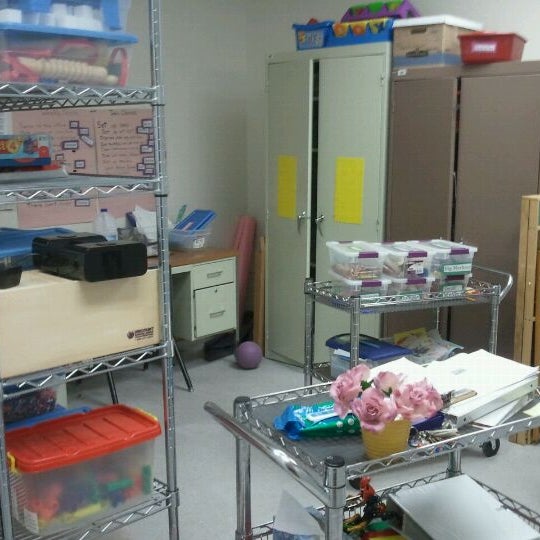
The width and height of the screenshot is (540, 540). I want to click on clear bins, so click(355, 263), click(399, 263), click(455, 253), click(411, 281), click(372, 281), click(87, 487), click(83, 15), click(82, 52), click(186, 237).